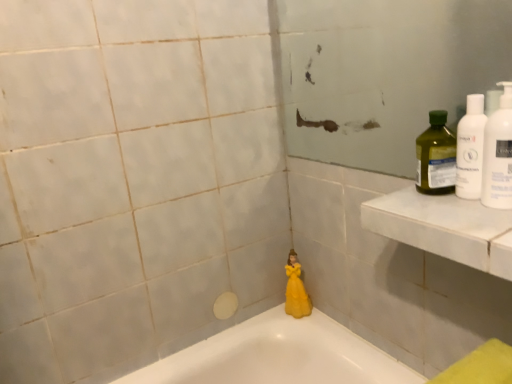
What do you see at coordinates (296, 289) in the screenshot? I see `yellow matte figurine at center` at bounding box center [296, 289].

Locate an element on the screen. white plastic bottle at upper right, the second cleaning product viewed from the front is located at coordinates (470, 148).

This screenshot has width=512, height=384. Find the location of `yellow matte figurine at center`. yellow matte figurine at center is located at coordinates (296, 289).

From a real-world perspective, which object rests below the other?

In real-world perspective, white plastic bottle at upper right, the 2th cleaning product when ordered from back to front, is lower.

Is white plastic bottle at upper right, the 3th cleaning product in the back-to-front sequence, directly adjacent to white plastic bottle at upper right, the 2th cleaning product when ordered from back to front?

Yes, white plastic bottle at upper right, the 3th cleaning product in the back-to-front sequence, is in contact with white plastic bottle at upper right, the 2th cleaning product when ordered from back to front.

Is white plastic bottle at upper right, the 3th cleaning product in the back-to-front sequence, to the right of white plastic bottle at upper right, the 2th cleaning product when ordered from back to front, from the viewer's perspective?

Yes.

From the image's perspective, is white plastic bottle at upper right, the first cleaning product in the front-to-back sequence, under white plastic bottle at upper right, the second cleaning product viewed from the front?

Yes, from the image's perspective, white plastic bottle at upper right, the first cleaning product in the front-to-back sequence, is beneath white plastic bottle at upper right, the second cleaning product viewed from the front.

Is white marble ledge at upper right to the left or to the right of yellow matte figurine at center in the image?

From the image, it's evident that white marble ledge at upper right is to the right of yellow matte figurine at center.

Is white marble ledge at upper right far from yellow matte figurine at center?

They are positioned close to each other.

Looking at their sizes, would you say white marble ledge at upper right is wider or thinner than yellow matte figurine at center?

Considering their sizes, white marble ledge at upper right looks broader than yellow matte figurine at center.

Looking at their sizes, would you say white marble ledge at upper right is wider or thinner than white plastic bottle at upper right, the first cleaning product in the front-to-back sequence?

Considering their sizes, white marble ledge at upper right looks broader than white plastic bottle at upper right, the first cleaning product in the front-to-back sequence.

Is point (479, 239) positioned behind point (495, 155)?

That is False.

Visually, is white marble ledge at upper right positioned to the left or to the right of white plastic bottle at upper right, the first cleaning product in the front-to-back sequence?

In the image, white marble ledge at upper right appears on the left side of white plastic bottle at upper right, the first cleaning product in the front-to-back sequence.

Are white marble ledge at upper right and white plastic bottle at upper right, the first cleaning product in the front-to-back sequence, beside each other?

There is a gap between white marble ledge at upper right and white plastic bottle at upper right, the first cleaning product in the front-to-back sequence.

Considering the points (490, 222) and (470, 186), which point is behind, point (490, 222) or point (470, 186)?

Point (470, 186)

Choose the correct answer: Is white marble ledge at upper right inside white plastic bottle at upper right, the second cleaning product viewed from the front, or outside it?

white marble ledge at upper right is spatially situated outside white plastic bottle at upper right, the second cleaning product viewed from the front.

Considering the relative sizes of white marble ledge at upper right and white plastic bottle at upper right, the second cleaning product viewed from the front, in the image provided, is white marble ledge at upper right thinner than white plastic bottle at upper right, the second cleaning product viewed from the front,?

No, white marble ledge at upper right is not thinner than white plastic bottle at upper right, the second cleaning product viewed from the front.

In terms of height, does yellow matte figurine at center look taller or shorter compared to green plastic bottle at upper right, the third cleaning product viewed from the front?

yellow matte figurine at center is taller than green plastic bottle at upper right, the third cleaning product viewed from the front.

Is yellow matte figurine at center to the right of green plastic bottle at upper right, the first cleaning product positioned from the back, from the viewer's perspective?

No.

Considering the relative sizes of yellow matte figurine at center and green plastic bottle at upper right, the first cleaning product positioned from the back, in the image provided, is yellow matte figurine at center smaller than green plastic bottle at upper right, the first cleaning product positioned from the back,?

Incorrect, yellow matte figurine at center is not smaller in size than green plastic bottle at upper right, the first cleaning product positioned from the back.

Is point (298, 310) positioned in front of point (443, 162)?

No, (298, 310) is further to viewer.

Considering the sizes of objects white plastic bottle at upper right, the 3th cleaning product in the back-to-front sequence, and white marble ledge at upper right in the image provided, who is taller, white plastic bottle at upper right, the 3th cleaning product in the back-to-front sequence, or white marble ledge at upper right?

Standing taller between the two is white plastic bottle at upper right, the 3th cleaning product in the back-to-front sequence.

Relative to white marble ledge at upper right, is white plastic bottle at upper right, the first cleaning product in the front-to-back sequence, in front or behind?

In the image, white plastic bottle at upper right, the first cleaning product in the front-to-back sequence, appears behind white marble ledge at upper right.

Which point is more forward, (504, 90) or (431, 206)?

The point (504, 90) is more forward.

Would you say yellow matte figurine at center is a long distance from white marble ledge at upper right?

yellow matte figurine at center is actually quite close to white marble ledge at upper right.

Which object is thinner, yellow matte figurine at center or white marble ledge at upper right?

yellow matte figurine at center.

Can you tell me how much yellow matte figurine at center and white marble ledge at upper right differ in facing direction?

There is a 68.9-degree angle between the facing directions of yellow matte figurine at center and white marble ledge at upper right.

Which of these two, yellow matte figurine at center or white marble ledge at upper right, is smaller?

yellow matte figurine at center is smaller.

At what (x,y) coordinates should I click in order to perform the action: click on the 1st cleaning product below the white plastic bottle at upper right, the first cleaning product in the front-to-back sequence (from a real-world perspective). Please return your answer as a coordinate pair (x, y). Looking at the image, I should click on (470, 148).

I want to click on toy behind the white marble ledge at upper right, so click(x=296, y=289).

Which object lies further to the anchor point green plastic bottle at upper right, the first cleaning product positioned from the back, yellow matte figurine at center or white plastic bottle at upper right, the second cleaning product viewed from the front?

The object further to green plastic bottle at upper right, the first cleaning product positioned from the back, is yellow matte figurine at center.

Considering their positions, is white plastic bottle at upper right, the 3th cleaning product in the back-to-front sequence, positioned further to yellow matte figurine at center than green plastic bottle at upper right, the first cleaning product positioned from the back?

Among the two, white plastic bottle at upper right, the 3th cleaning product in the back-to-front sequence, is located further to yellow matte figurine at center.

When comparing their distances from green plastic bottle at upper right, the first cleaning product positioned from the back, does white marble ledge at upper right or white plastic bottle at upper right, the 2th cleaning product when ordered from back to front, seem further?

A: white marble ledge at upper right.

Which object lies nearer to the anchor point white plastic bottle at upper right, the 3th cleaning product in the back-to-front sequence, white plastic bottle at upper right, the 2th cleaning product when ordered from back to front, or white marble ledge at upper right?

white plastic bottle at upper right, the 2th cleaning product when ordered from back to front, lies closer to white plastic bottle at upper right, the 3th cleaning product in the back-to-front sequence, than the other object.

Estimate the real-world distances between objects in this image. Which object is further from yellow matte figurine at center, green plastic bottle at upper right, the first cleaning product positioned from the back, or white plastic bottle at upper right, the 2th cleaning product when ordered from back to front?

Based on the image, white plastic bottle at upper right, the 2th cleaning product when ordered from back to front, appears to be further to yellow matte figurine at center.

When comparing their distances from white plastic bottle at upper right, the 3th cleaning product in the back-to-front sequence, does white marble ledge at upper right or white plastic bottle at upper right, the second cleaning product viewed from the front, seem closer?

white plastic bottle at upper right, the second cleaning product viewed from the front, is positioned closer to the anchor white plastic bottle at upper right, the 3th cleaning product in the back-to-front sequence.

Based on their spatial positions, is green plastic bottle at upper right, the third cleaning product viewed from the front, or white plastic bottle at upper right, the 3th cleaning product in the back-to-front sequence, further from yellow matte figurine at center?

The object further to yellow matte figurine at center is white plastic bottle at upper right, the 3th cleaning product in the back-to-front sequence.

Looking at this image, when comparing their distances from white marble ledge at upper right, does green plastic bottle at upper right, the third cleaning product viewed from the front, or yellow matte figurine at center seem further?

Among the two, yellow matte figurine at center is located further to white marble ledge at upper right.

Identify the location of cleaning product between white plastic bottle at upper right, the second cleaning product viewed from the front, and yellow matte figurine at center in the front-back direction. (436, 156).

Where is `cleaning product between white plastic bottle at upper right, the 3th cleaning product in the back-to-front sequence, and green plastic bottle at upper right, the third cleaning product viewed from the front, from front to back`? The image size is (512, 384). cleaning product between white plastic bottle at upper right, the 3th cleaning product in the back-to-front sequence, and green plastic bottle at upper right, the third cleaning product viewed from the front, from front to back is located at coordinates (470, 148).